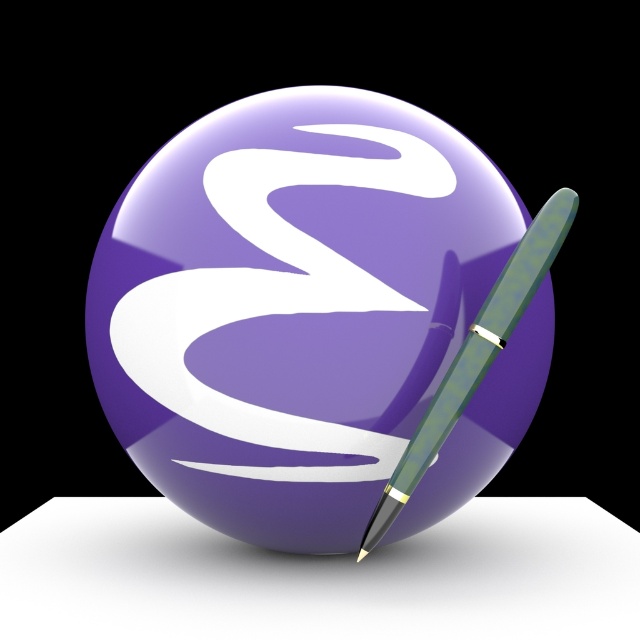
Question: Does glossy purple sphere at center have a larger size compared to translucent green fountain pen at right?

Choices:
 (A) yes
 (B) no

Answer: (A)

Question: Does glossy purple sphere at center come behind translucent green fountain pen at right?

Choices:
 (A) yes
 (B) no

Answer: (A)

Question: Which point is farther to the camera?

Choices:
 (A) (268, 134)
 (B) (403, 486)

Answer: (A)

Question: Is glossy purple sphere at center thinner than translucent green fountain pen at right?

Choices:
 (A) yes
 (B) no

Answer: (B)